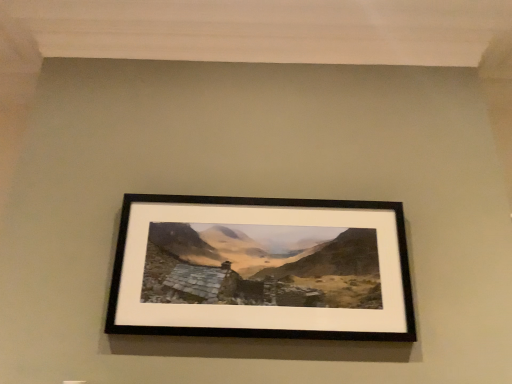
This screenshot has height=384, width=512. I want to click on black matte picture frame at center, so click(x=261, y=269).

Measure the distance between black matte picture frame at center and camera.

black matte picture frame at center and camera are 4.73 feet apart.

What do you see at coordinates (261, 269) in the screenshot? I see `black matte picture frame at center` at bounding box center [261, 269].

You are a GUI agent. You are given a task and a screenshot of the screen. Output one action in this format:
    pyautogui.click(x=<x>, y=<y>)
    Task: Click on the black matte picture frame at center
    This screenshot has width=512, height=384.
    Given the screenshot: What is the action you would take?
    pyautogui.click(x=261, y=269)